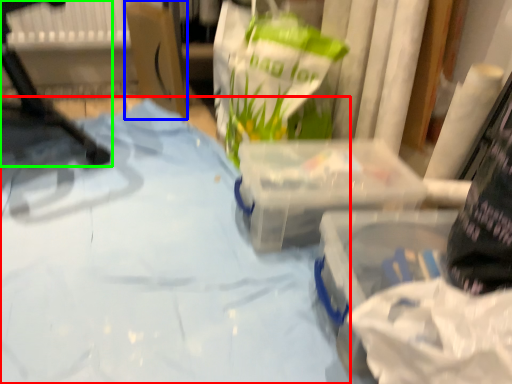
Question: Considering the real-world distances, which object is closest to sheet (highlighted by a red box)? cardboard box (highlighted by a blue box) or furniture (highlighted by a green box).

Choices:
 (A) cardboard box
 (B) furniture

Answer: (B)